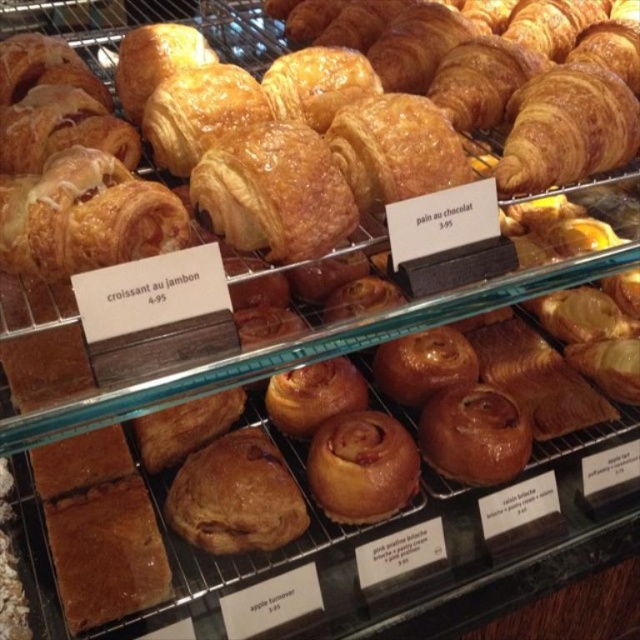
You are a customer at the bakery and want to buy both the golden brown flaky pastry at center and the golden brown doughnut at center. The store has a promotion where if one item is larger than the other, you can get the smaller one for half price. Which pastry would be eligible for the discount?

The golden brown doughnut at center would be eligible for the discount because it is smaller than the golden brown flaky pastry at center.

You are a customer at the bakery and want to buy the golden brown flaky pastry at center and the golden brown flaky croissant at upper center. The cashier asks you to estimate the total price based on their sizes. Which one is more expensive?

The golden brown flaky croissant at upper center is larger than the golden brown flaky pastry at center, so it is more expensive. Therefore, the croissant at upper center is more expensive than the pastry at center.

You are a customer looking at the display case and want to buy both the golden brown doughnut at center and the golden brown flaky croissant at upper center. Which item is located higher in the display case?

The golden brown flaky croissant at upper center is located higher in the display case than the golden brown doughnut at center.